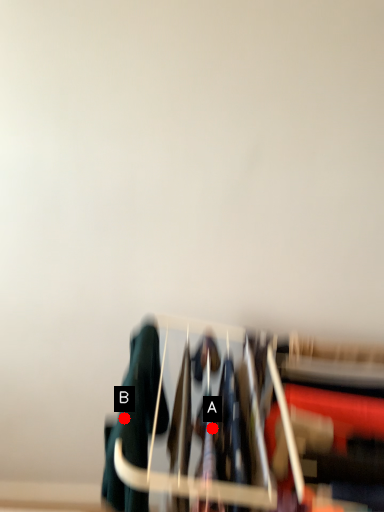
Question: Two points are circled on the image, labeled by A and B beside each circle. Which of the following is the closest to the observer?

Choices:
 (A) A is closer
 (B) B is closer

Answer: (B)